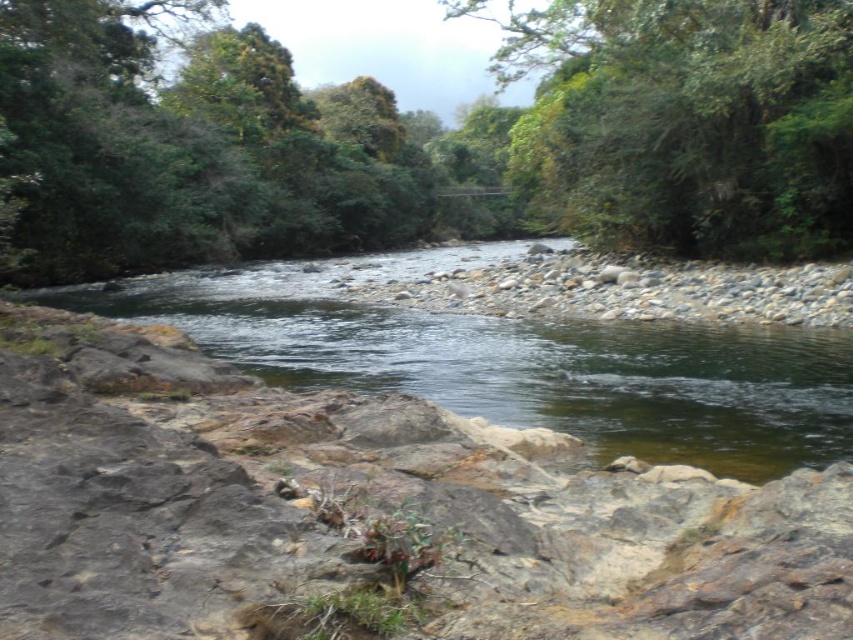
Image resolution: width=853 pixels, height=640 pixels. What do you see at coordinates (363, 513) in the screenshot?
I see `rocky at lower left` at bounding box center [363, 513].

Measure the distance between rocky at lower left and green leafy tree at center.

They are 117.17 feet apart.

Does point (146, 436) come farther from viewer compared to point (790, 54)?

No, (146, 436) is in front of (790, 54).

Identify the location of rocky at lower left. Image resolution: width=853 pixels, height=640 pixels. (363, 513).

Is point (740, 548) positioned behind point (212, 276)?

No, it is in front of (212, 276).

Does rocky at lower left lie behind clear water at center?

No.

The image size is (853, 640). Identify the location of rocky at lower left. (363, 513).

Can you confirm if green leafy tree at center is positioned below green leafy tree at upper center?

Yes, green leafy tree at center is below green leafy tree at upper center.

Who is positioned more to the left, green leafy tree at center or green leafy tree at upper center?

From the viewer's perspective, green leafy tree at center appears more on the left side.

Does point (325, 182) come in front of point (598, 173)?

No, (325, 182) is behind (598, 173).

I want to click on green leafy tree at center, so click(x=425, y=140).